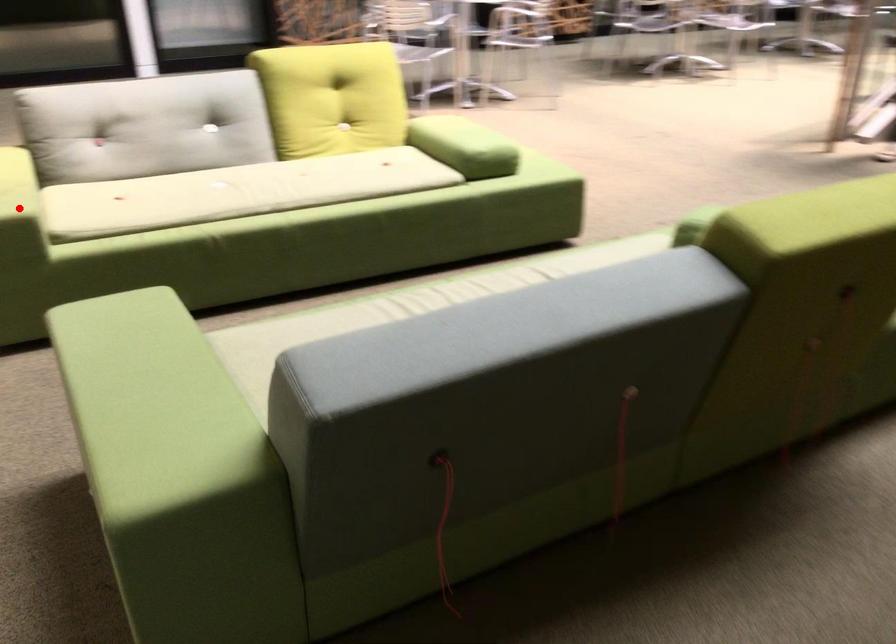
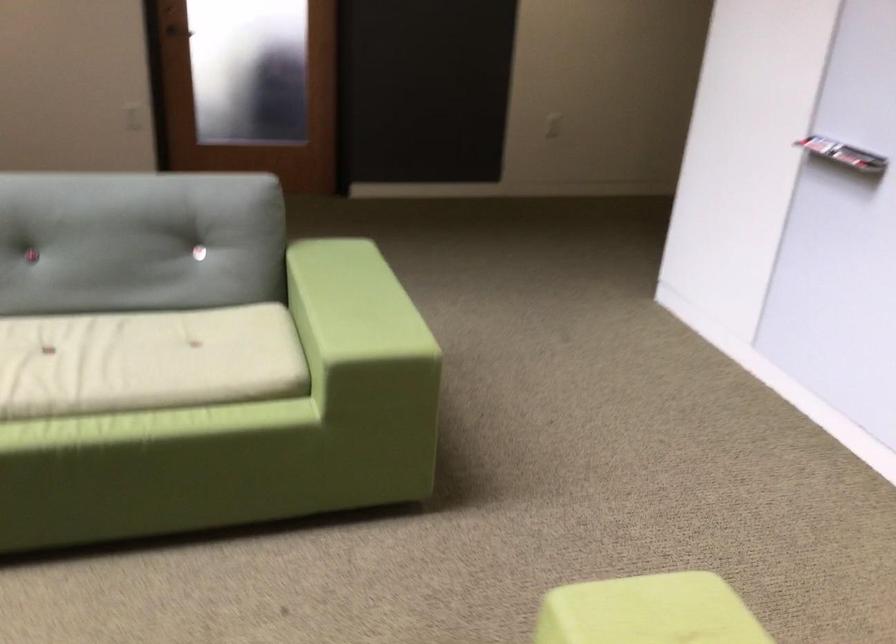
Question: I am providing you with two images of the same scene from different viewpoints. A red point is marked on the first image. Can you still see the location of the red point in image 2?

Choices:
 (A) Yes
 (B) No

Answer: (B)